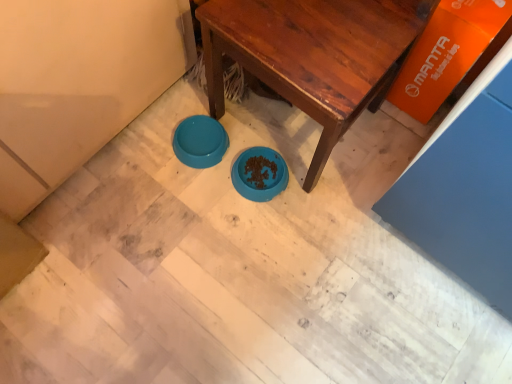
The image size is (512, 384). In order to click on vacant region to the left of teal plastic bowl at center in this screenshot , I will do `click(144, 145)`.